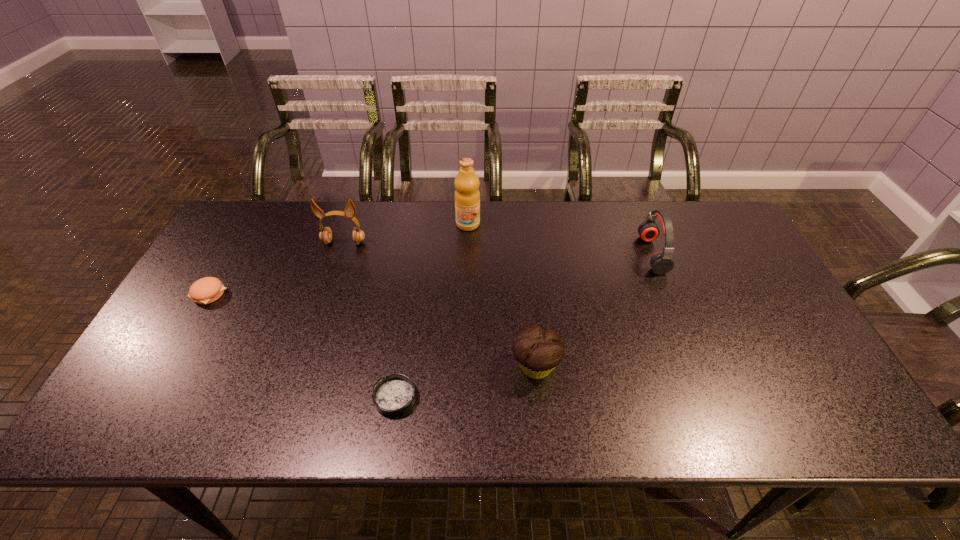
The width and height of the screenshot is (960, 540). Find the location of `the fourth object from left to right`. the fourth object from left to right is located at coordinates (467, 196).

You are a GUI agent. You are given a task and a screenshot of the screen. Output one action in this format:
    pyautogui.click(x=<x>, y=<y>)
    Task: Click on the tallest object
    
    Given the screenshot: What is the action you would take?
    pyautogui.click(x=467, y=196)

Locate an element on the screen. The image size is (960, 540). the left earphone is located at coordinates (325, 235).

This screenshot has height=540, width=960. Identify the location of the rightmost object. (661, 263).

The image size is (960, 540). I want to click on the shorter earphone, so click(x=661, y=263).

Where is `the third shortest object`? Image resolution: width=960 pixels, height=540 pixels. the third shortest object is located at coordinates (538, 351).

The height and width of the screenshot is (540, 960). In order to click on the second object from right to left in this screenshot , I will do `click(538, 351)`.

At what (x,y) coordinates should I click in order to perform the action: click on the third nearest object. Please return your answer as a coordinate pair (x, y). The image size is (960, 540). Looking at the image, I should click on coord(206,290).

I want to click on the fifth tallest object, so click(x=206, y=290).

Find the location of a particular element. The width and height of the screenshot is (960, 540). the shortest object is located at coordinates (394, 395).